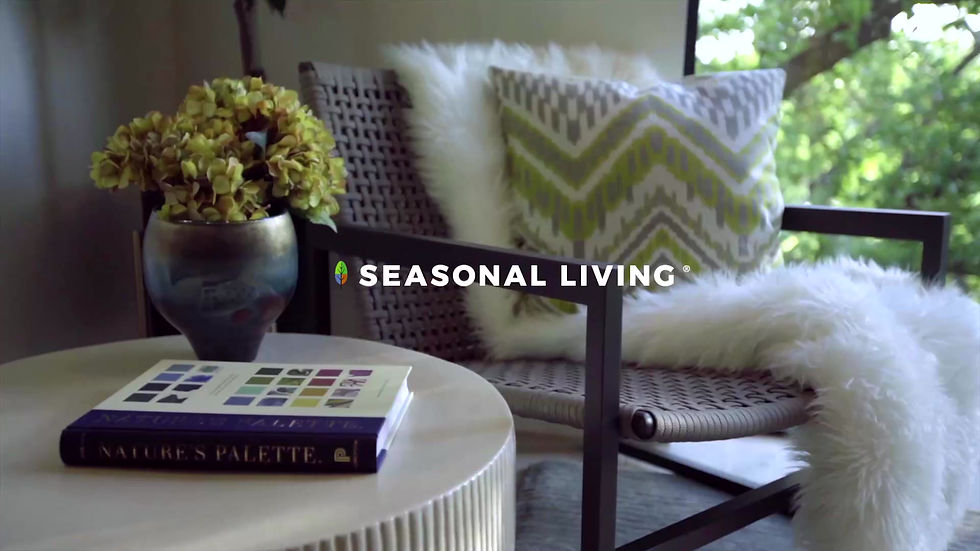
The height and width of the screenshot is (551, 980). I want to click on wall, so coord(91,82).